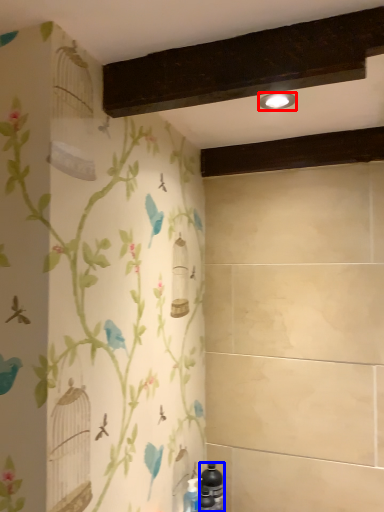
Question: Which of the following is the closest to the observer, light fixture (highlighted by a red box) or bottle (highlighted by a blue box)?

Choices:
 (A) light fixture
 (B) bottle

Answer: (A)